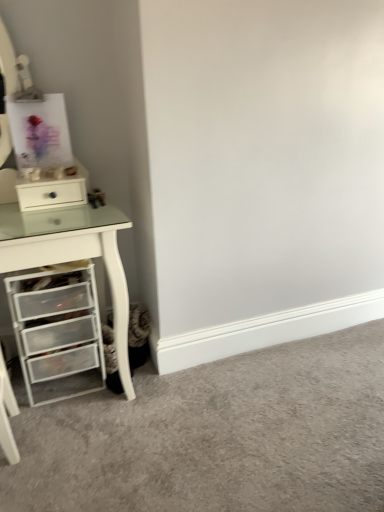
Question: Is white plastic drawers at lower left taller or shorter than white plastic drawer unit at left?

Choices:
 (A) tall
 (B) short

Answer: (B)

Question: From a real-world perspective, is white plastic drawers at lower left physically located above or below white plastic drawer unit at left?

Choices:
 (A) below
 (B) above

Answer: (A)

Question: Based on their relative distances, which object is farther from the white glossy drawer at upper left?

Choices:
 (A) white plastic drawer unit at left
 (B) white plastic drawers at lower left

Answer: (B)

Question: Estimate the real-world distances between objects in this image. Which object is farther from the white plastic drawers at lower left?

Choices:
 (A) white glossy drawer at upper left
 (B) white plastic drawer unit at left

Answer: (A)